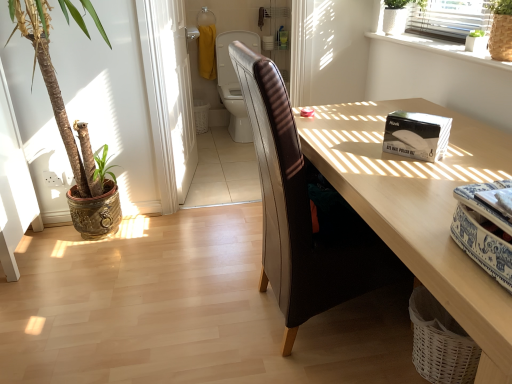
Question: From the image's perspective, is leather at center above or below white wicker laundry basket at lower right?

Choices:
 (A) below
 (B) above

Answer: (B)

Question: Is leather at center taller or shorter than white wicker laundry basket at lower right?

Choices:
 (A) tall
 (B) short

Answer: (A)

Question: Considering the real-world distances, which object is farthest from the white glossy nail polish kit at upper right?

Choices:
 (A) green leafy plant at upper right, positioned as the second houseplant in right-to-left order
 (B) green woven basket at upper right, the first houseplant from the right
 (C) white glossy screen door at upper center
 (D) green leafy plant in textured pot at left, which is the 4th houseplant in right-to-left order
 (E) leather-like brown swivel chair at center

Answer: (E)

Question: Considering the real-world distances, which object is farthest from the white glossy window sill at upper right?

Choices:
 (A) white glossy screen door at upper center
 (B) light wood desk at center
 (C) leather-like brown swivel chair at center
 (D) green woven basket at upper right, which is the fourth houseplant in left-to-right order
 (E) leather at center

Answer: (C)